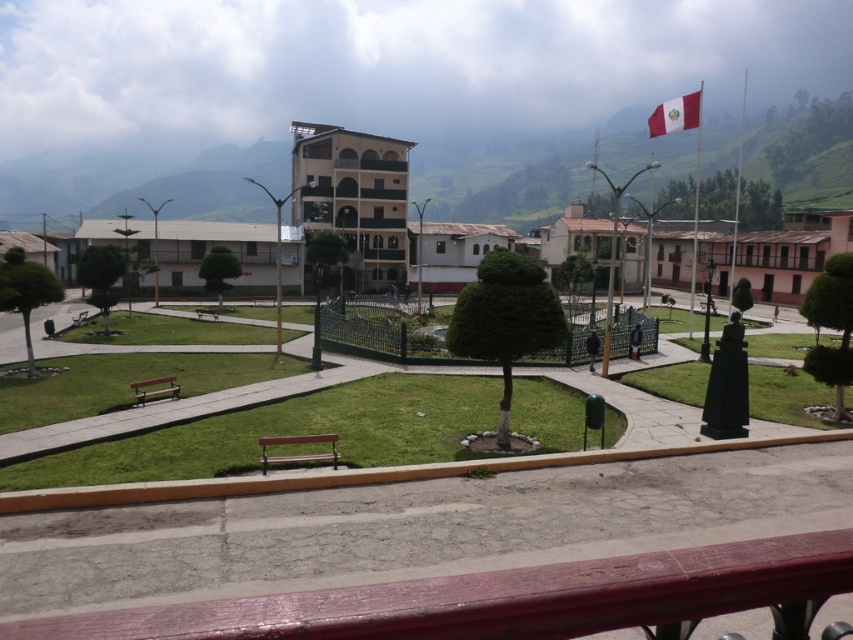
Question: Among these objects, which one is farthest from the camera?

Choices:
 (A) smooth wood bench at lower center
 (B) wooden park bench at center
 (C) wooden park bench at lower left
 (D) red fabric flag at upper right

Answer: (B)

Question: Can you confirm if smooth wood bench at lower center is positioned to the right of wooden park bench at center?

Choices:
 (A) no
 (B) yes

Answer: (B)

Question: Which point is farther to the camera?

Choices:
 (A) brown wooden bench at center
 (B) smooth wood bench at lower center
 (C) wooden park bench at center
 (D) red fabric flag at upper right

Answer: (C)

Question: Which object appears closest to the camera in this image?

Choices:
 (A) smooth wood bench at lower center
 (B) green grassy hillside at upper center
 (C) wooden park bench at lower left

Answer: (A)

Question: Does green grassy hillside at upper center appear on the left side of wooden park bench at center?

Choices:
 (A) yes
 (B) no

Answer: (B)

Question: Is red fabric flag at upper right below wooden park bench at center?

Choices:
 (A) yes
 (B) no

Answer: (B)